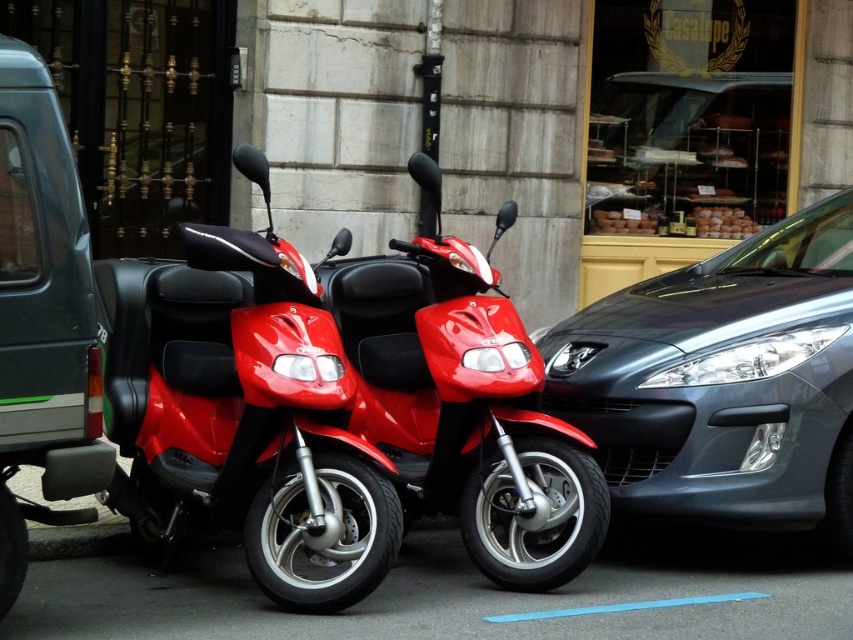
Does matte red scooter at center have a lesser width compared to glossy red scooter at center?

In fact, matte red scooter at center might be wider than glossy red scooter at center.

Who is shorter, matte red scooter at center or glossy red scooter at center?

glossy red scooter at center

Find the location of `matte red scooter at center`. matte red scooter at center is located at coordinates (242, 413).

Does metallic gray car at center right have a greater height compared to matte gray minivan at left?

No.

Is point (647, 289) closer to camera compared to point (83, 216)?

No, (647, 289) is further to viewer.

Identify the location of metallic gray car at center right. (724, 381).

You are a GUI agent. You are given a task and a screenshot of the screen. Output one action in this format:
    pyautogui.click(x=<x>, y=<y>)
    Task: Click on the metallic gray car at center right
    This screenshot has height=640, width=853.
    Given the screenshot: What is the action you would take?
    pyautogui.click(x=724, y=381)

Measure the distance between metallic gray car at center right and glossy red scooter at center.

A distance of 3.37 feet exists between metallic gray car at center right and glossy red scooter at center.

Who is positioned more to the right, metallic gray car at center right or glossy red scooter at center?

metallic gray car at center right is more to the right.

Is point (821, 481) positioned in front of point (380, 396)?

Yes, point (821, 481) is in front of point (380, 396).

Locate an element on the screen. The image size is (853, 640). metallic gray car at center right is located at coordinates (724, 381).